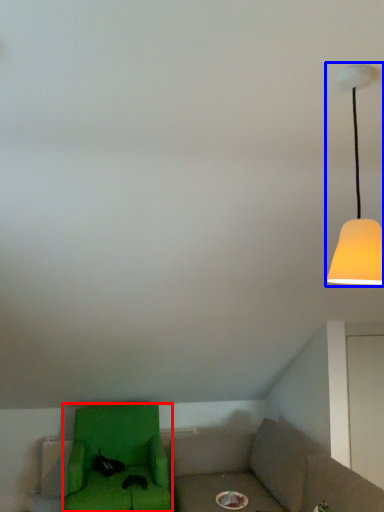
Question: Which object appears closest to the camera in this image, furniture (highlighted by a red box) or lamp (highlighted by a blue box)?

Choices:
 (A) furniture
 (B) lamp

Answer: (B)